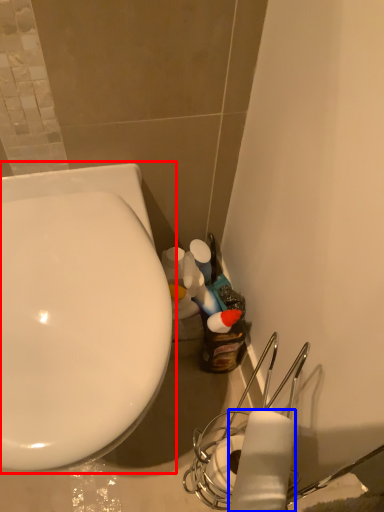
Question: Which object appears farthest to the camera in this image, toilet (highlighted by a red box) or toilet paper (highlighted by a blue box)?

Choices:
 (A) toilet
 (B) toilet paper

Answer: (A)